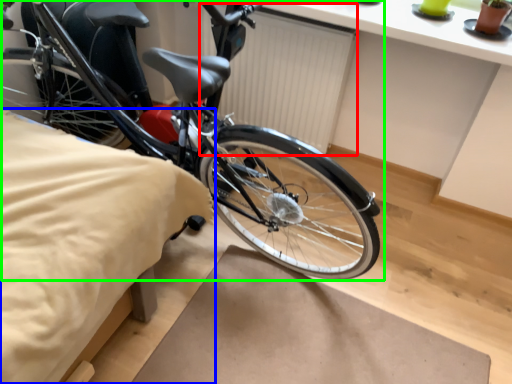
Question: Considering the real-world distances, which object is farthest from radiator (highlighted by a red box)? sheet (highlighted by a blue box) or bicycle (highlighted by a green box)?

Choices:
 (A) sheet
 (B) bicycle

Answer: (A)